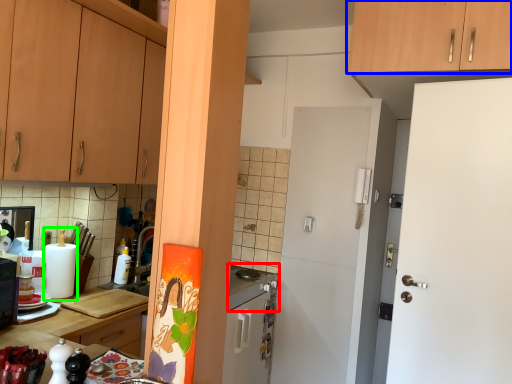
Question: Which is farther away from gas stove (highlighted by a red box)? cabinetry (highlighted by a blue box) or appliance (highlighted by a green box)?

Choices:
 (A) cabinetry
 (B) appliance

Answer: (A)